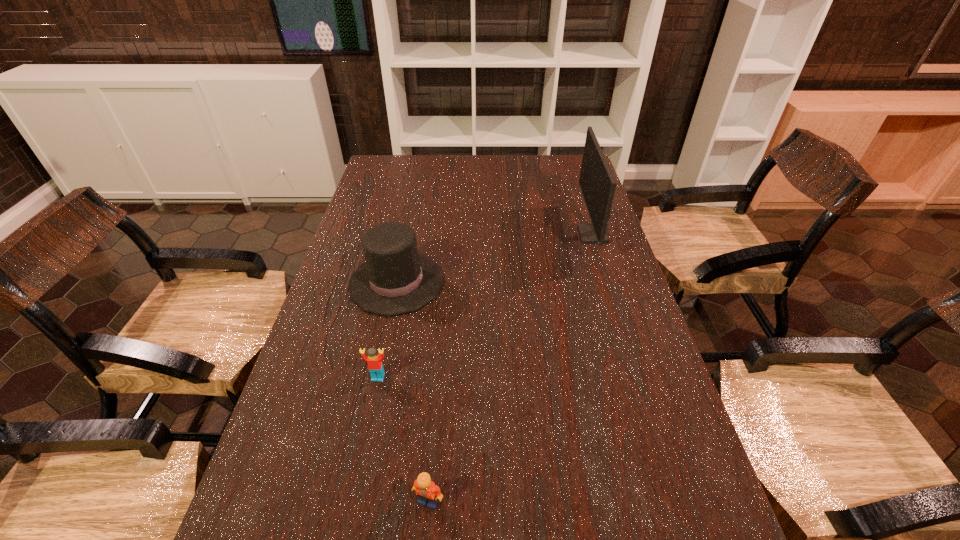
Identify the location of the rightmost object. The height and width of the screenshot is (540, 960). (597, 183).

Locate an element on the screen. This screenshot has width=960, height=540. the tallest object is located at coordinates (597, 183).

The height and width of the screenshot is (540, 960). I want to click on the third shortest object, so click(x=395, y=279).

In order to click on the left Lego in this screenshot , I will do `click(374, 360)`.

Locate an element on the screen. The width and height of the screenshot is (960, 540). the farther Lego is located at coordinates (374, 360).

Find the location of a particular element. the right Lego is located at coordinates (426, 490).

Locate an element on the screen. The height and width of the screenshot is (540, 960). the nearer Lego is located at coordinates (426, 490).

Find the location of `free region located on the front-facing side of the tallest object`. free region located on the front-facing side of the tallest object is located at coordinates (507, 234).

You are a GUI agent. You are given a task and a screenshot of the screen. Output one action in this format:
    pyautogui.click(x=<x>, y=<y>)
    Task: Click on the blank area located on the front-facing side of the tallest object
    The width and height of the screenshot is (960, 540).
    Given the screenshot: What is the action you would take?
    pyautogui.click(x=501, y=234)

The image size is (960, 540). I want to click on vacant region located on the front-facing side of the tallest object, so click(x=501, y=234).